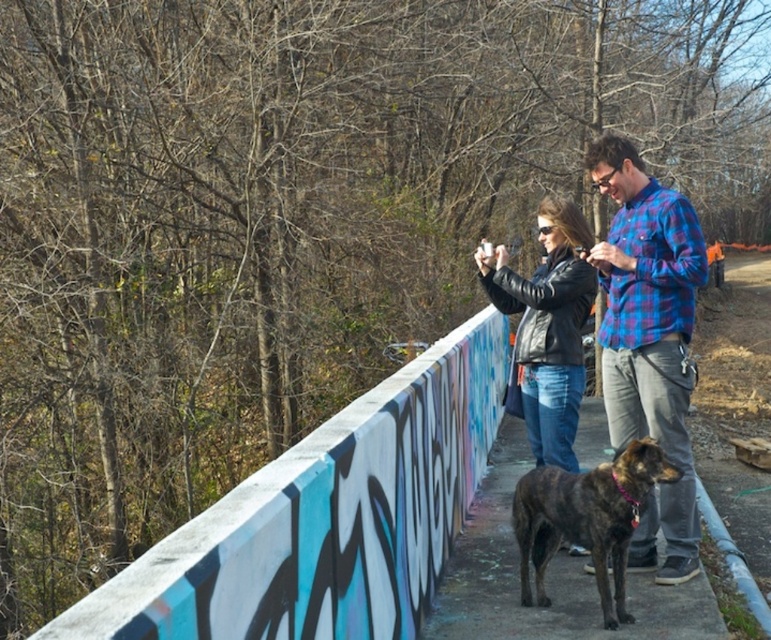
Consider the image. You are a photographer trying to capture the graffiti on the bridge. You have two points marked in your viewfinder at coordinates point (682, 529) and point (463, 582). Which point is closer to your camera lens?

Point (682, 529) is closer to the camera lens than point (463, 582).

You are a photographer trying to capture both the black leather jacket at center and the brindle fur dog at lower center in the same frame. Which object should you focus on first to ensure both are in focus?

The black leather jacket at center is closer to the viewer than the brindle fur dog at lower center. To ensure both are in focus, you should focus on the black leather jacket at center first, as it is the closer object.